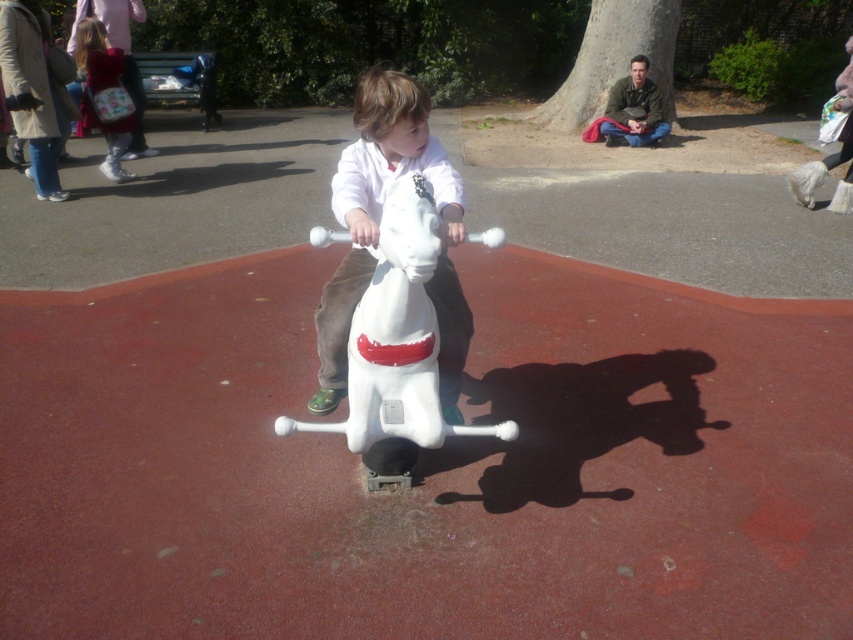
Which is below, white plastic horse at center or velvet red backpack at upper left?

Positioned lower is white plastic horse at center.

Looking at this image, does white plastic horse at center appear over velvet red backpack at upper left?

Actually, white plastic horse at center is below velvet red backpack at upper left.

Where is `white plastic horse at center`? This screenshot has height=640, width=853. white plastic horse at center is located at coordinates (396, 348).

This screenshot has width=853, height=640. I want to click on white plastic horse at center, so click(x=396, y=348).

Does white matte horse at center have a smaller size compared to velvet red backpack at upper left?

Incorrect, white matte horse at center is not smaller in size than velvet red backpack at upper left.

Is point (463, 328) more distant than point (96, 36)?

No, it is not.

Does point (442, 208) lie behind point (102, 118)?

That is False.

Image resolution: width=853 pixels, height=640 pixels. I want to click on white matte horse at center, so click(x=376, y=205).

Does white plastic horse at center appear over white matte horse at center?

No, white plastic horse at center is not above white matte horse at center.

Which is in front, point (317, 244) or point (397, 72)?

Point (317, 244)

Where is `white plastic horse at center`? white plastic horse at center is located at coordinates (396, 348).